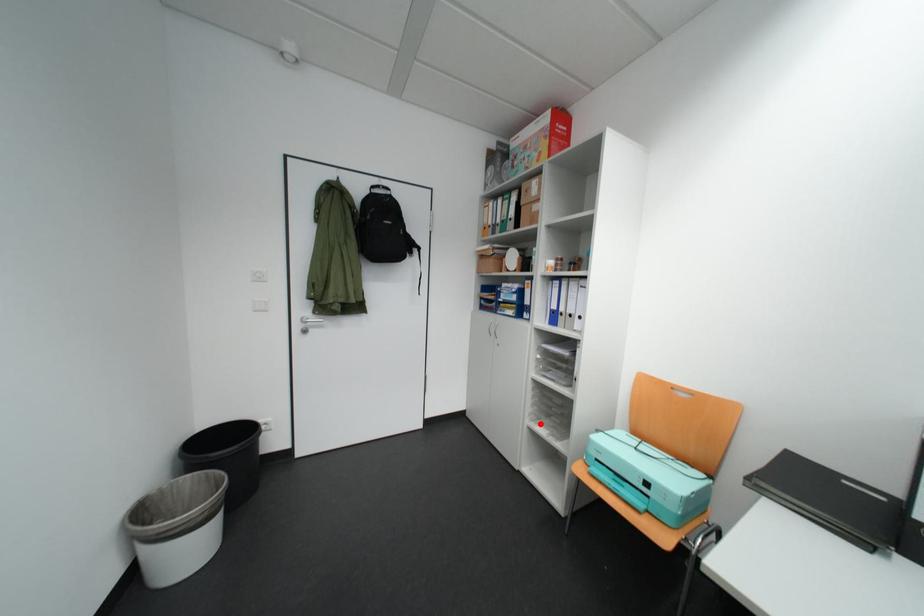
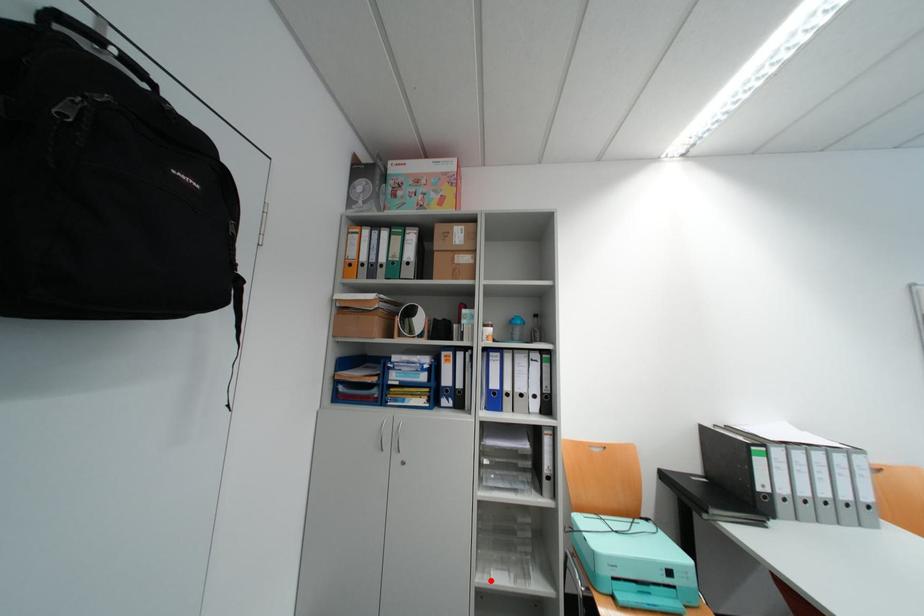
I am providing you with two images of the same scene from different viewpoints. A red point is marked on the first image and another point is marked on the second image. Do the highlighted points in image1 and image2 indicate the same real-world spot?

Yes